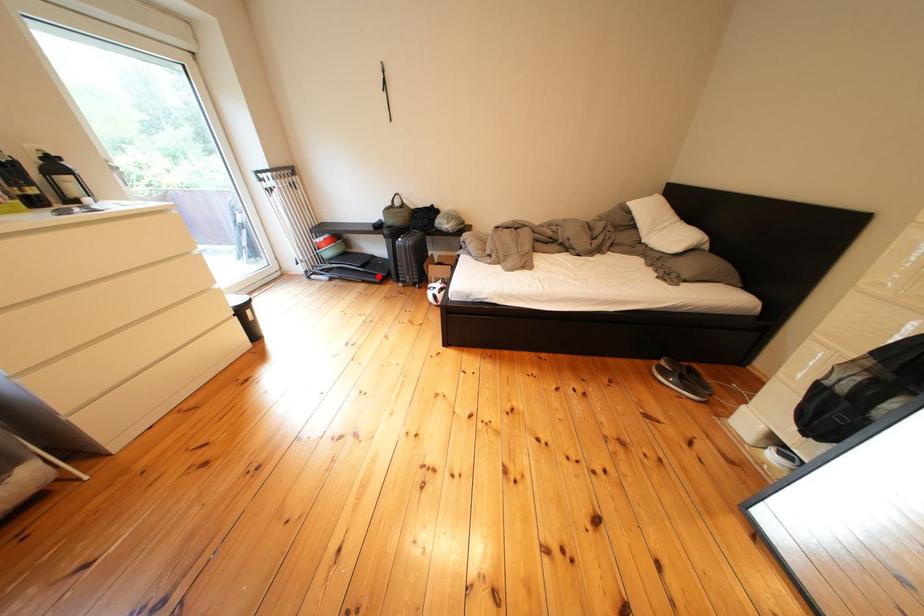
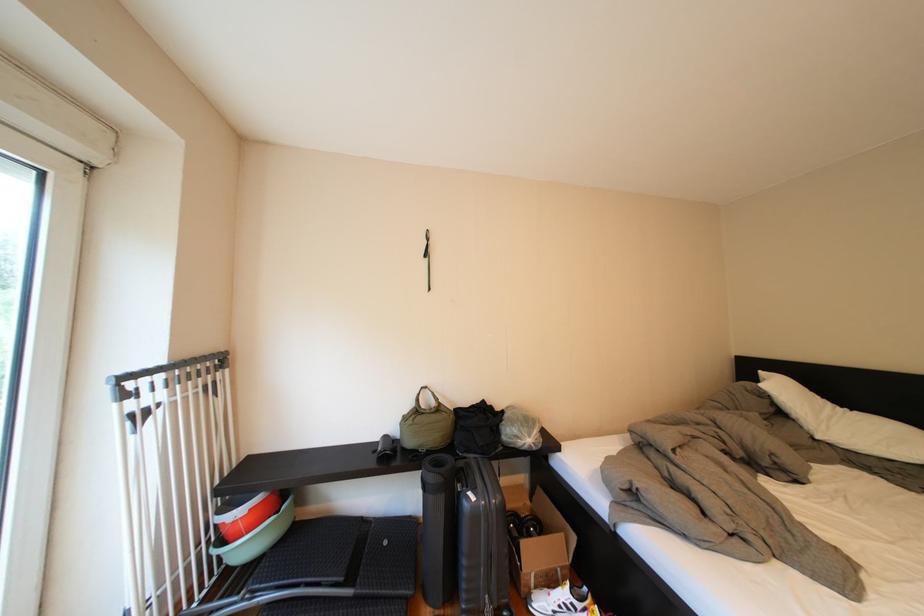
In the second image, find the point that corresponds to the highlighted location in the first image.

(370, 602)